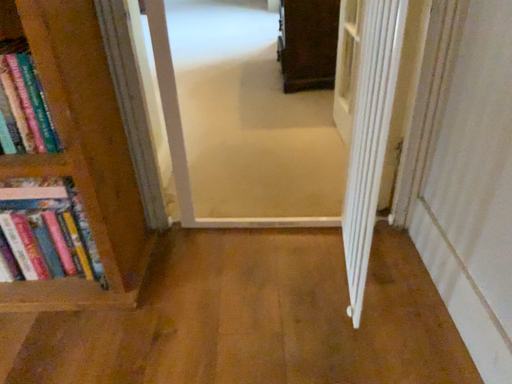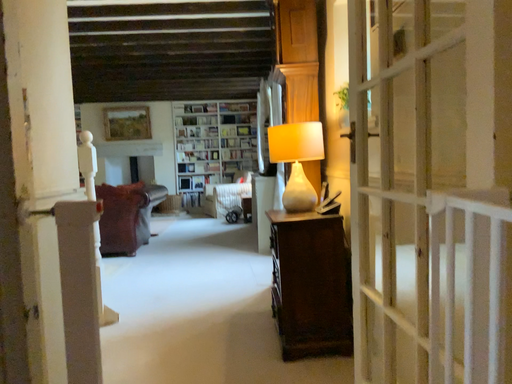
Question: How did the camera likely rotate when shooting the video?

Choices:
 (A) rotated downward
 (B) rotated upward

Answer: (B)